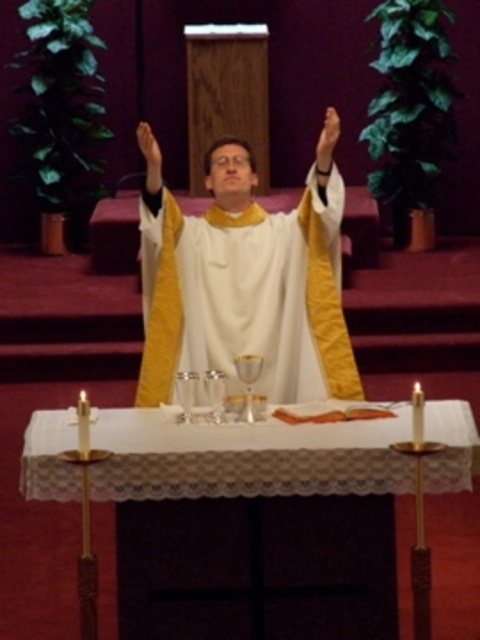
Question: Is white satin robe at center smaller than white lace tablecloth at center?

Choices:
 (A) no
 (B) yes

Answer: (A)

Question: Among these points, which one is farthest from the camera?

Choices:
 (A) (231, 173)
 (B) (64, 611)

Answer: (A)

Question: Which object appears farthest from the camera in this image?

Choices:
 (A) white lace tablecloth at center
 (B) white satin robe at center

Answer: (B)

Question: Is white satin robe at center smaller than white lace tablecloth at center?

Choices:
 (A) no
 (B) yes

Answer: (A)

Question: Can you confirm if white satin robe at center is positioned below white lace tablecloth at center?

Choices:
 (A) no
 (B) yes

Answer: (A)